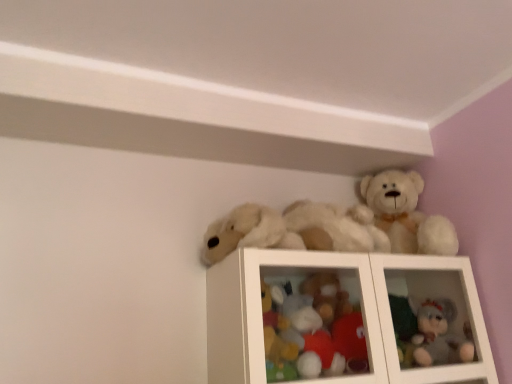
Question: Considering the relative positions of gray plush bear at upper right, which ranks as the third toy in left-to-right order, and fluffy fabric teddy bear at upper right, which is the 2th toy from right to left, in the image provided, is gray plush bear at upper right, which ranks as the third toy in left-to-right order, in front of fluffy fabric teddy bear at upper right, which is the 2th toy from right to left,?

Choices:
 (A) no
 (B) yes

Answer: (A)

Question: From the image's perspective, would you say gray plush bear at upper right, which ranks as the third toy in left-to-right order, is positioned over fluffy fabric teddy bear at upper right, which is the 2th toy from right to left?

Choices:
 (A) no
 (B) yes

Answer: (A)

Question: Is the depth of gray plush bear at upper right, which ranks as the third toy in left-to-right order, greater than that of fluffy fabric teddy bear at upper right, which is the 2th toy from right to left?

Choices:
 (A) no
 (B) yes

Answer: (B)

Question: Is gray plush bear at upper right, which ranks as the third toy in left-to-right order, aimed at fluffy fabric teddy bear at upper right, acting as the second toy starting from the left?

Choices:
 (A) no
 (B) yes

Answer: (A)

Question: Is gray plush bear at upper right, the first toy positioned from the right, not close to fluffy fabric teddy bear at upper right, acting as the second toy starting from the left?

Choices:
 (A) yes
 (B) no

Answer: (B)

Question: From a real-world perspective, is gray plush bear at upper right, the first toy positioned from the right, physically located above or below white plush bear at upper center, which is the first toy in left-to-right order?

Choices:
 (A) above
 (B) below

Answer: (B)

Question: From the image's perspective, is gray plush bear at upper right, which ranks as the third toy in left-to-right order, located above or below white plush bear at upper center, the third toy viewed from the right?

Choices:
 (A) above
 (B) below

Answer: (B)

Question: In terms of height, does gray plush bear at upper right, the first toy positioned from the right, look taller or shorter compared to white plush bear at upper center, which is the first toy in left-to-right order?

Choices:
 (A) tall
 (B) short

Answer: (B)

Question: Considering the positions of point (415, 364) and point (370, 192), is point (415, 364) closer or farther from the camera than point (370, 192)?

Choices:
 (A) closer
 (B) farther

Answer: (A)

Question: Is point (307, 317) closer or farther from the camera than point (260, 241)?

Choices:
 (A) farther
 (B) closer

Answer: (A)

Question: Would you say fluffy fabric teddy bear at upper right, acting as the second toy starting from the left, is to the left or to the right of white plush bear at upper center, the third toy viewed from the right, in the picture?

Choices:
 (A) left
 (B) right

Answer: (B)

Question: Is fluffy fabric teddy bear at upper right, which is the 2th toy from right to left, inside or outside of white plush bear at upper center, which is the first toy in left-to-right order?

Choices:
 (A) outside
 (B) inside

Answer: (A)

Question: From the image's perspective, is fluffy fabric teddy bear at upper right, which is the 2th toy from right to left, located above or below white plush bear at upper center, which is the first toy in left-to-right order?

Choices:
 (A) above
 (B) below

Answer: (B)

Question: Is gray plush bear at upper right, which ranks as the third toy in left-to-right order, in front of or behind fluffy fabric teddy bear at upper right, which is the 2th toy from right to left, in the image?

Choices:
 (A) front
 (B) behind

Answer: (B)

Question: Choose the correct answer: Is gray plush bear at upper right, the first toy positioned from the right, inside fluffy fabric teddy bear at upper right, acting as the second toy starting from the left, or outside it?

Choices:
 (A) outside
 (B) inside

Answer: (A)